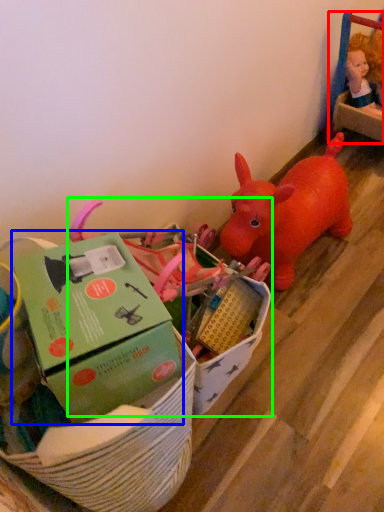
Question: Considering the real-world distances, which object is farthest from toy (highlighted by a red box)? box (highlighted by a blue box) or toy (highlighted by a green box)?

Choices:
 (A) box
 (B) toy

Answer: (A)